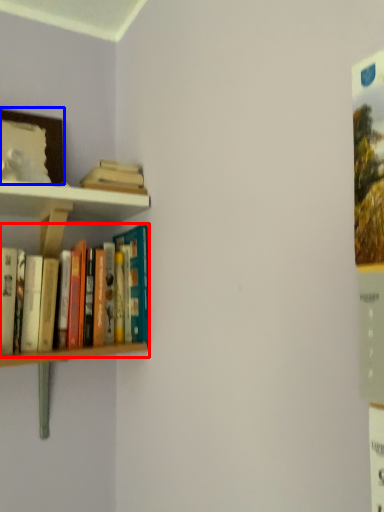
Question: Which of the following is the closest to the observer, book (highlighted by a red box) or picture frame (highlighted by a blue box)?

Choices:
 (A) book
 (B) picture frame

Answer: (A)